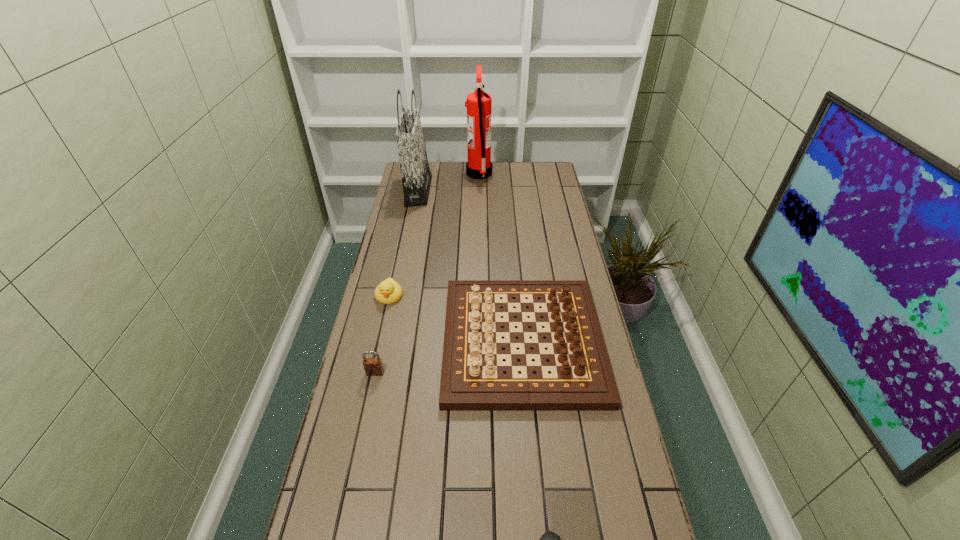
Find the location of a particular element. fire extinguisher is located at coordinates pyautogui.click(x=479, y=104).

I want to click on shopping bag, so click(416, 176).

At what (x,y) coordinates should I click in order to perform the action: click on gameboard. Please return your answer as a coordinate pair (x, y). The height and width of the screenshot is (540, 960). Looking at the image, I should click on (472, 378).

Find the location of a particular element. padlock is located at coordinates [x=373, y=366].

Locate an element on the screen. This screenshot has width=960, height=540. duckling is located at coordinates tap(389, 291).

At what (x,y) coordinates should I click in order to perform the action: click on vacant space positioned with the nozzle aimed from the fire extinguisher. Please return your answer as a coordinate pair (x, y). Looking at the image, I should click on (553, 174).

What are the coordinates of `free space located 0.080m on the front of the shopping bag with the design` in the screenshot? It's located at (447, 191).

Identify the location of free region located on the side with the white pieces of the gameboard. The width and height of the screenshot is (960, 540). (391, 341).

Where is `vacant space located 0.220m on the side with the white pieces of the gameboard`? This screenshot has height=540, width=960. vacant space located 0.220m on the side with the white pieces of the gameboard is located at coordinates (375, 341).

The image size is (960, 540). I want to click on free space located 0.050m on the side with the white pieces of the gameboard, so click(429, 341).